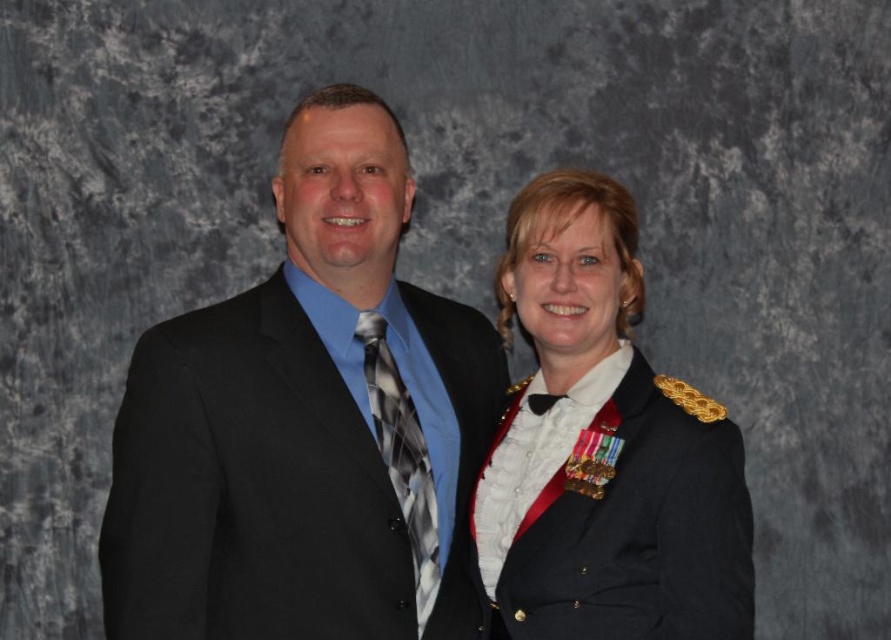
Question: Among these objects, which one is nearest to the camera?

Choices:
 (A) black suit at left
 (B) plaid silk tie at center
 (C) shiny black uniform at center

Answer: (A)

Question: Among these points, which one is farthest from the camera?

Choices:
 (A) (266, 413)
 (B) (605, 433)
 (C) (370, 388)

Answer: (B)

Question: Considering the relative positions of black suit at left and shiny black uniform at center in the image provided, where is black suit at left located with respect to shiny black uniform at center?

Choices:
 (A) left
 (B) right

Answer: (A)

Question: Observing the image, what is the correct spatial positioning of shiny black uniform at center in reference to plaid silk tie at center?

Choices:
 (A) above
 (B) below

Answer: (A)

Question: Which point is farther to the camera?

Choices:
 (A) black suit at left
 (B) plaid silk tie at center
 (C) shiny black uniform at center

Answer: (B)

Question: Does black suit at left have a lesser width compared to plaid silk tie at center?

Choices:
 (A) no
 (B) yes

Answer: (A)